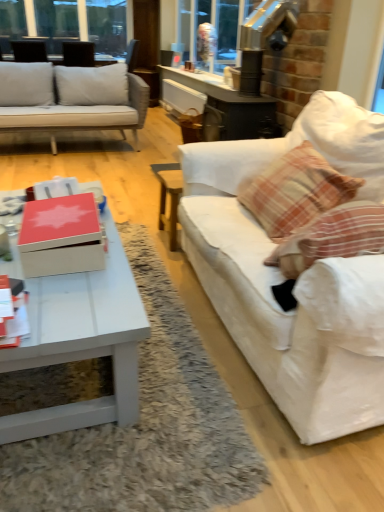
Where is `vacant area in front of matte red box at center`? This screenshot has width=384, height=512. vacant area in front of matte red box at center is located at coordinates (67, 298).